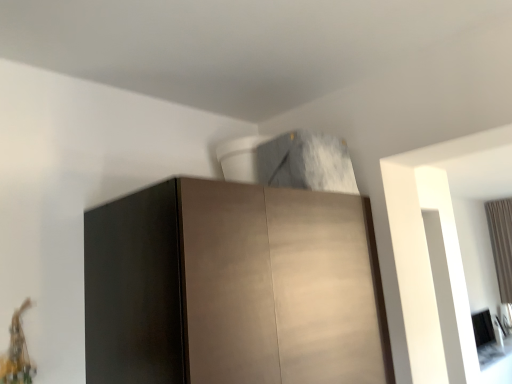
What is the approximate width of matte brown cabinet at center?

matte brown cabinet at center is 25.14 inches wide.

I want to click on matte brown cabinet at center, so click(233, 287).

The image size is (512, 384). What do you see at coordinates (233, 287) in the screenshot?
I see `matte brown cabinet at center` at bounding box center [233, 287].

Identify the location of matte brown cabinet at center. (233, 287).